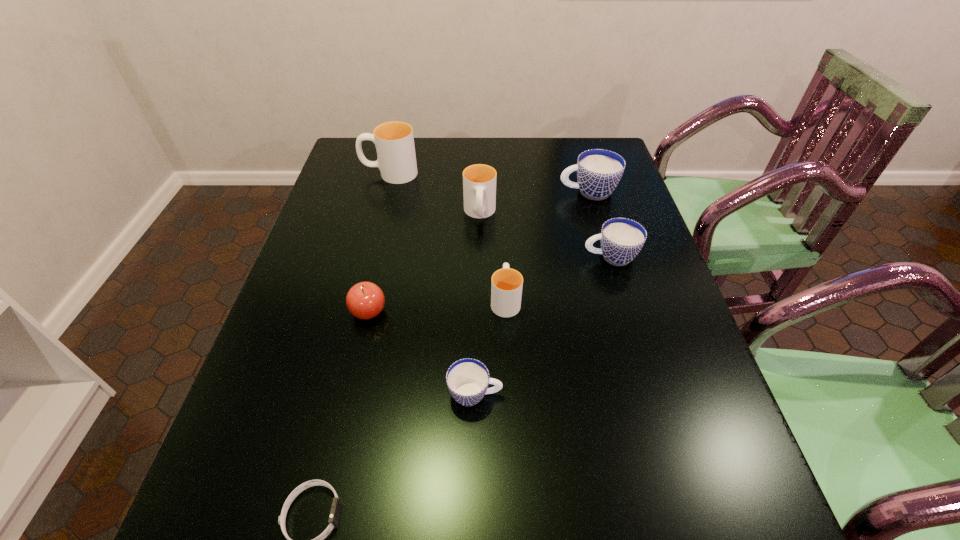
Find the location of a particular element. The width and height of the screenshot is (960, 540). the smallest blue cup is located at coordinates (467, 379).

Where is `free space located 0.070m with the handle on the side of the leftmost cup`? Image resolution: width=960 pixels, height=540 pixels. free space located 0.070m with the handle on the side of the leftmost cup is located at coordinates (340, 173).

Find the location of a particular element. The width and height of the screenshot is (960, 540). vacant space situated with the handle on the side of the second smallest yellow cup is located at coordinates (480, 273).

The height and width of the screenshot is (540, 960). Identify the location of free space located on the side of the biggest blue cup with the handle. (503, 192).

Find the location of a particular element. This screenshot has width=960, height=540. free region located 0.400m on the side of the biggest blue cup with the handle is located at coordinates (428, 192).

The image size is (960, 540). I want to click on blank space located 0.330m on the side of the biggest blue cup with the handle, so click(451, 192).

What are the coordinates of `vacant area located on the front of the apple` in the screenshot? It's located at (329, 483).

You are a GUI agent. You are given a task and a screenshot of the screen. Output one action in this format:
    pyautogui.click(x=<x>, y=<y>)
    Task: Click on the free region located 0.120m with the handle on the side of the second nearest cup
    Image resolution: width=960 pixels, height=540 pixels.
    Given the screenshot: What is the action you would take?
    pyautogui.click(x=503, y=250)

Identify the location of vacant space situated 0.200m with the handle on the side of the second nearest cup. (502, 231).

Locate an element on the screen. free space located 0.110m with the handle on the side of the second nearest cup is located at coordinates (503, 253).